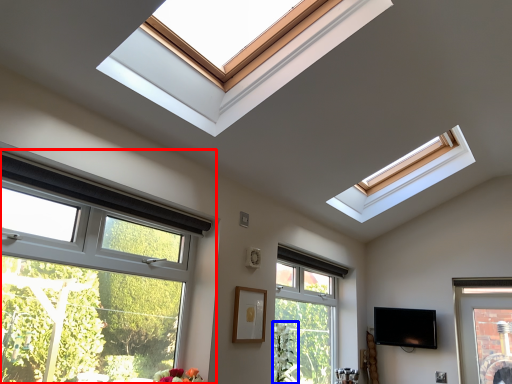
Question: Which object appears farthest to the camera in this image, window (highlighted by a red box) or plant (highlighted by a blue box)?

Choices:
 (A) window
 (B) plant

Answer: (B)